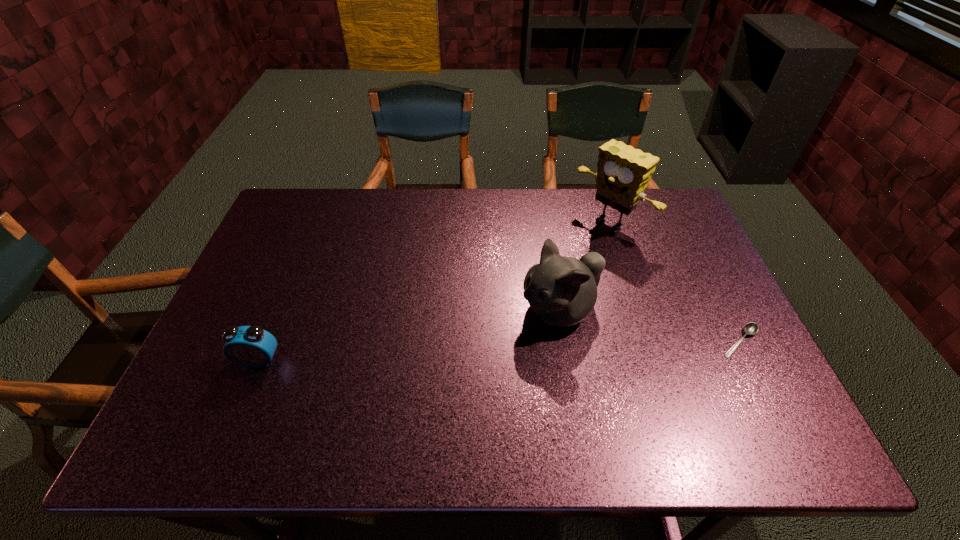
You are a GUI agent. You are given a task and a screenshot of the screen. Output one action in this format:
    pyautogui.click(x=<x>, y=<y>)
    Task: Click on the unoccupied area between the second shortest object and the farthest object
    The width and height of the screenshot is (960, 540).
    Given the screenshot: What is the action you would take?
    pyautogui.click(x=435, y=292)

Identify the location of free space between the shortest object and the third shortest object. (650, 326).

Where is `free spot between the soupspoon and the alarm clock`? This screenshot has height=540, width=960. free spot between the soupspoon and the alarm clock is located at coordinates (499, 351).

What are the coordinates of `empty space between the farthest object and the second shortest object` in the screenshot? It's located at (435, 292).

Find the location of a particular element. The image size is (960, 540). object that can be found as the third closest to the hamster is located at coordinates (250, 346).

The image size is (960, 540). What are the coordinates of `object that is the nearest to the third shortest object` in the screenshot? It's located at (623, 173).

In order to click on free location that satisfies the following two spatial constraints: 1. on the front side of the sponge; 2. on the right side of the soupspoon in this screenshot , I will do `click(649, 341)`.